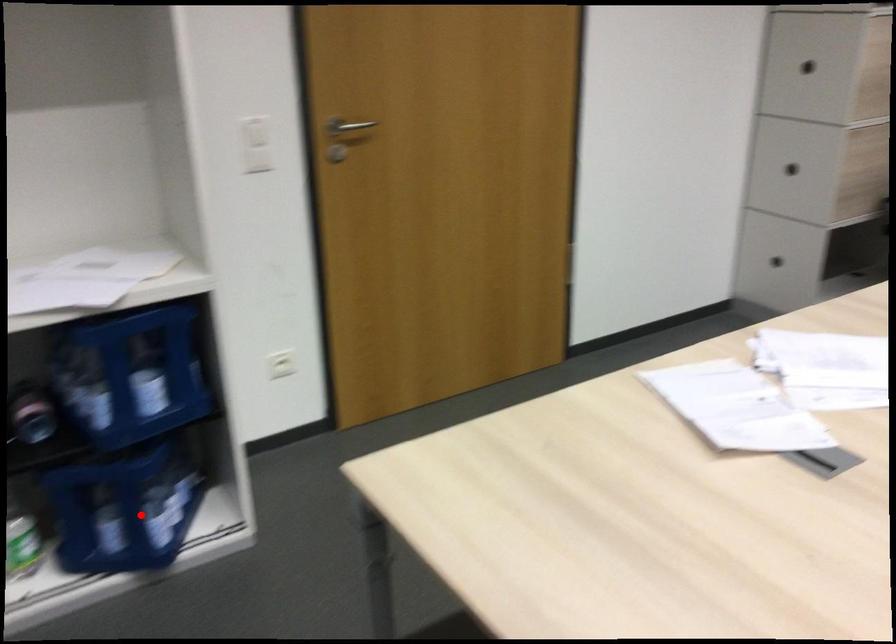
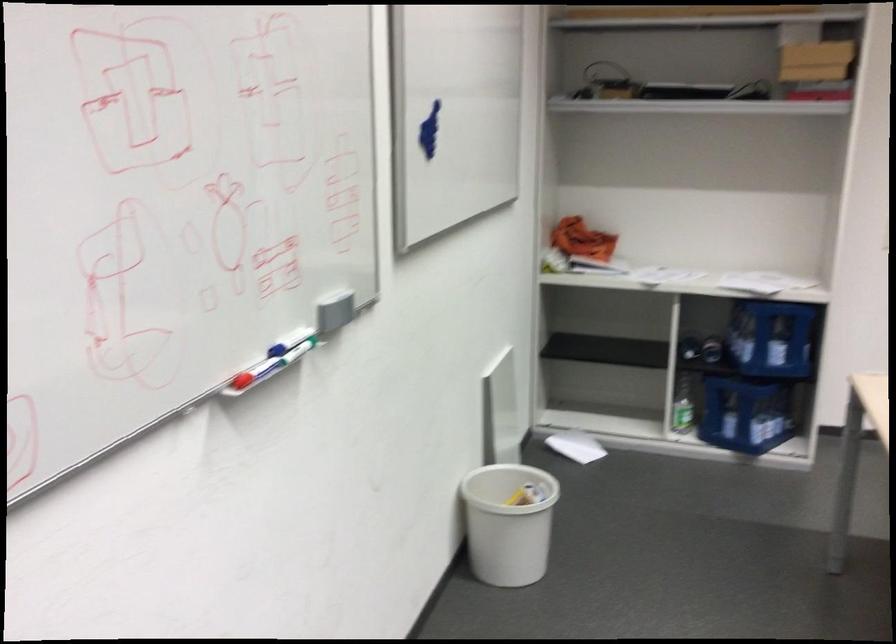
Question: I am providing you with two images of the same scene from different viewpoints. Image1 has a red point marked. In image2, the corresponding 3D location appears at what relative position? Reply with the corresponding letter.

Choices:
 (A) Closer
 (B) Farther

Answer: (B)